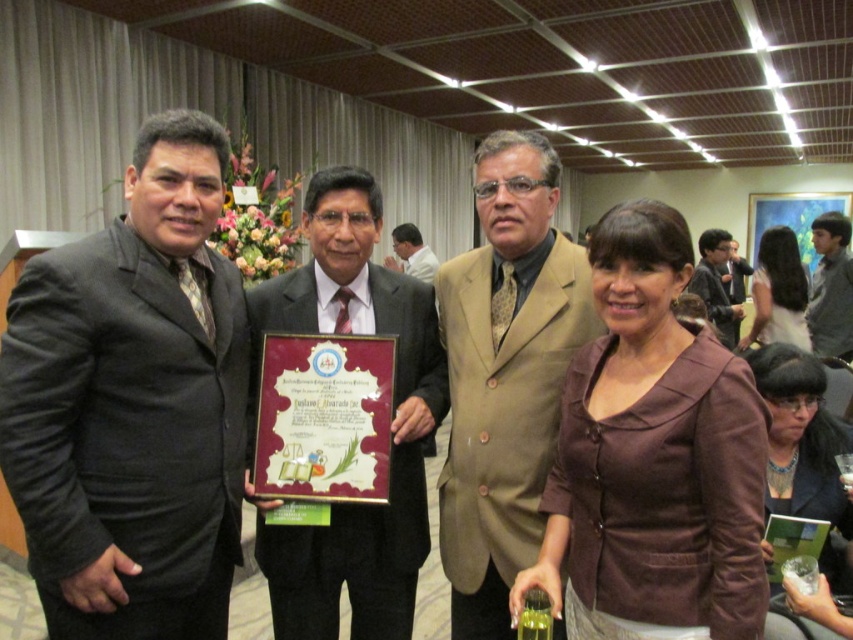
You are a photographer setting up for a group photo. You have a camera with a 30 cm wide lens. The dark brown suit at right and the green glass at lower center are in your frame. Which object will require the lens to be adjusted to a wider angle to capture fully?

The dark brown suit at right has a larger width than the green glass at lower center, so the lens needs to be adjusted to a wider angle to capture the dark brown suit at right fully.

You are a photographer at the event and need to ensure that all items are visible in the photo. The dark brown suit at right and the green glass at lower center are both in the frame. Which item takes up more space in the photo?

The dark brown suit at right takes up more space in the photo because it is bigger than the green glass at lower center according to the description.